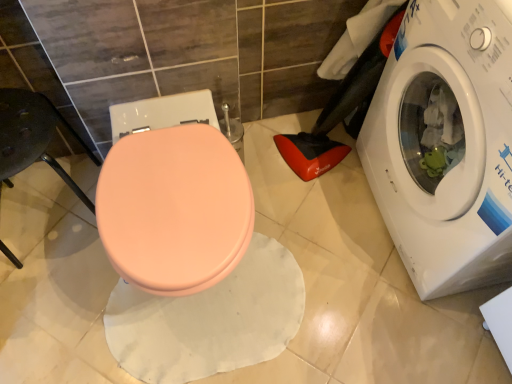
Where is `unoccupied region to the right of matte pink bidet at center`? The image size is (512, 384). unoccupied region to the right of matte pink bidet at center is located at coordinates (329, 256).